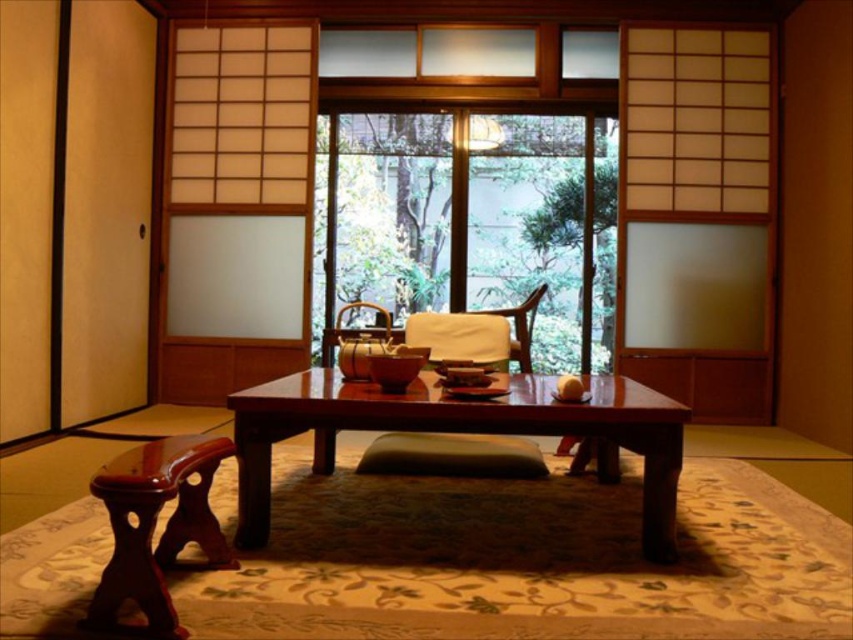
Between mahogany wood stool at lower left and white soft pillow at center, which one appears on the right side from the viewer's perspective?

Positioned to the right is white soft pillow at center.

Looking at this image, is mahogany wood stool at lower left wider than white soft pillow at center?

No, mahogany wood stool at lower left is not wider than white soft pillow at center.

Identify the location of mahogany wood stool at lower left. (154, 525).

Identify the location of mahogany wood stool at lower left. This screenshot has width=853, height=640. (154, 525).

Which is more to the right, brown leather chair at center or matte wood chair at center?

Positioned to the right is matte wood chair at center.

How distant is brown leather chair at center from matte wood chair at center?

brown leather chair at center and matte wood chair at center are 1.50 meters apart.

This screenshot has width=853, height=640. I want to click on brown leather chair at center, so click(x=360, y=339).

At what (x,y) coordinates should I click in order to perform the action: click on brown leather chair at center. Please return your answer as a coordinate pair (x, y). Looking at the image, I should click on (360, 339).

Is point (239, 472) less distant than point (386, 320)?

Yes.

You are a GUI agent. You are given a task and a screenshot of the screen. Output one action in this format:
    pyautogui.click(x=<x>, y=<y>)
    Task: Click on the wooden table at center
    This screenshot has width=853, height=640.
    Given the screenshot: What is the action you would take?
    pyautogui.click(x=460, y=432)

Where is `wooden table at center`? Image resolution: width=853 pixels, height=640 pixels. wooden table at center is located at coordinates (460, 432).